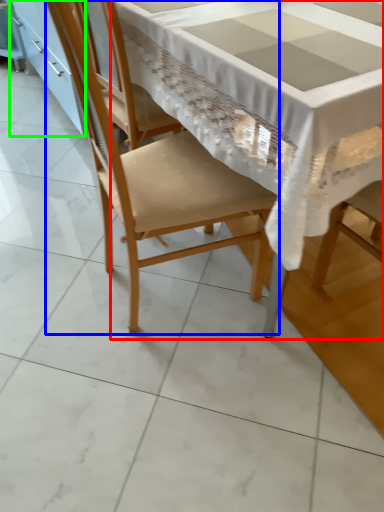
Question: Estimate the real-world distances between objects in this image. Which object is farther from table (highlighted by a red box), chair (highlighted by a blue box) or cabinetry (highlighted by a green box)?

Choices:
 (A) chair
 (B) cabinetry

Answer: (B)